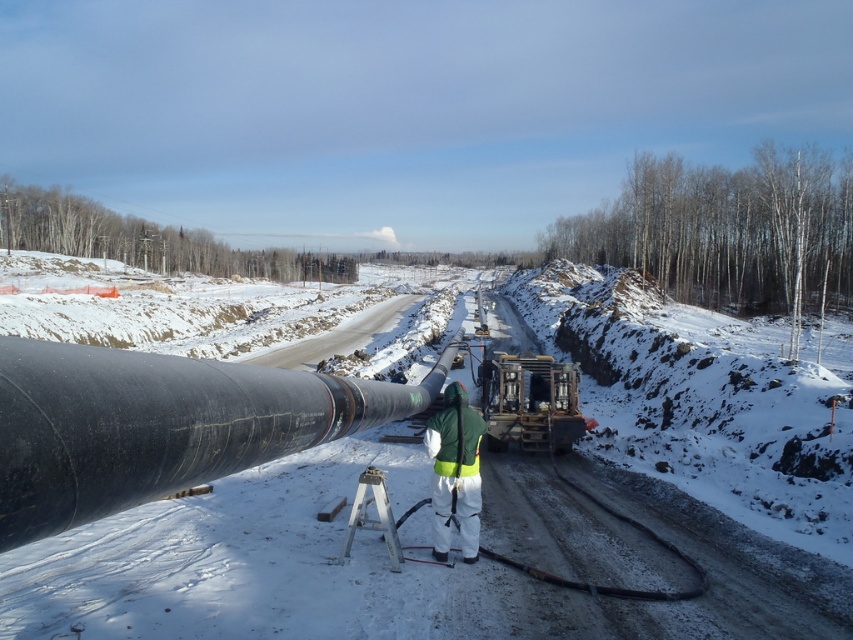
You are a safety inspector at the snowy construction site. You need to check if the green reflective safety suit at center is visible to the operator of the metallic yellow forklift at center. Based on their positions, can the operator see the safety suit?

The metallic yellow forklift at center is further to the viewer than green reflective safety suit at center, so the operator would be positioned closer to the viewer. Since the safety suit is closer to the forklift, the operator should be able to see the green reflective safety suit at center unless there are obstructions.

You are a worker standing at the point marked by coordinates point (369, 566). Looking around, you see the black rubber pipe at center. What is directly in front of you?

The point (369, 566) marks the black rubber pipe at center, so directly in front of you is the black rubber pipe at center.